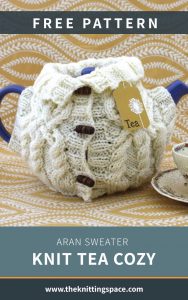
The image size is (188, 300). I want to click on plate, so click(167, 188).